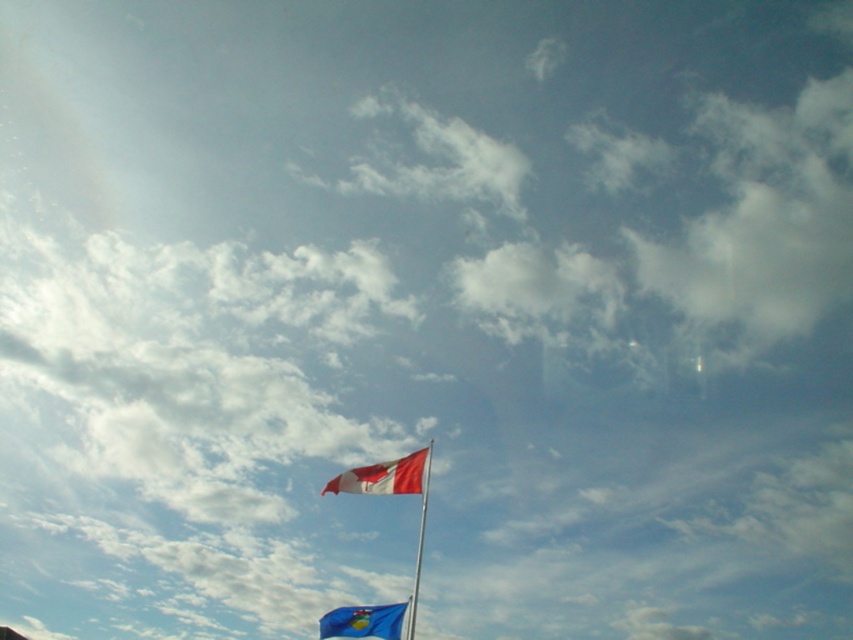
Question: Can you confirm if blue fabric flag at lower center is wider than metallic flag pole at center?

Choices:
 (A) no
 (B) yes

Answer: (B)

Question: Which object appears farthest from the camera in this image?

Choices:
 (A) blue fabric flag at lower center
 (B) metallic flag pole at center

Answer: (A)

Question: Does blue fabric flag at lower center appear on the right side of metallic flag pole at center?

Choices:
 (A) yes
 (B) no

Answer: (B)

Question: Which of the following is the farthest from the observer?

Choices:
 (A) red fabric flag at center
 (B) metallic flag pole at center
 (C) blue fabric flag at lower center

Answer: (A)

Question: Among these points, which one is nearest to the camera?

Choices:
 (A) (325, 616)
 (B) (379, 472)

Answer: (A)

Question: Does red fabric flag at center have a larger size compared to blue fabric flag at lower center?

Choices:
 (A) no
 (B) yes

Answer: (B)